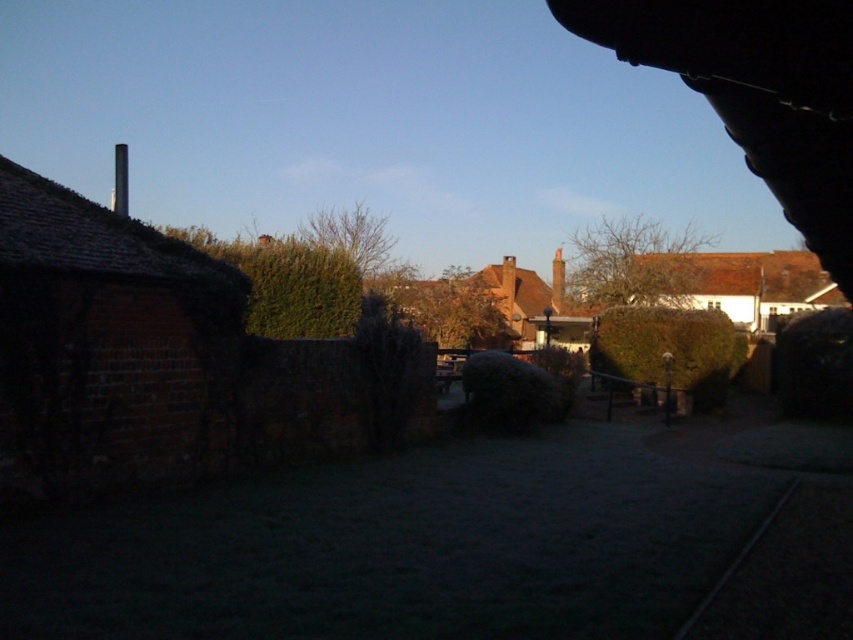
Who is shorter, smooth white chimney at upper left or smooth brick chimney at center?

smooth brick chimney at center

Who is more forward, (115, 182) or (554, 264)?

Point (554, 264) is in front.

Describe the element at coordinates (120, 180) in the screenshot. Image resolution: width=853 pixels, height=640 pixels. I see `smooth white chimney at upper left` at that location.

At what (x,y) coordinates should I click in order to perform the action: click on smooth white chimney at upper left. Please return your answer as a coordinate pair (x, y). Looking at the image, I should click on (120, 180).

Is black metal train track at lower right bigger than smooth brick chimney at center?

Actually, black metal train track at lower right might be smaller than smooth brick chimney at center.

Which is below, black metal train track at lower right or smooth brick chimney at center?

black metal train track at lower right is lower down.

Between point (782, 497) and point (555, 282), which one is positioned in front?

Point (782, 497) is in front.

Find the location of a particular element. The width and height of the screenshot is (853, 640). black metal train track at lower right is located at coordinates (734, 563).

Does black metal train track at lower right appear over smooth white chimney at upper left?

No.

Is point (753, 529) positioned in front of point (126, 154)?

Yes.

What do you see at coordinates (734, 563) in the screenshot?
I see `black metal train track at lower right` at bounding box center [734, 563].

This screenshot has width=853, height=640. Identify the location of black metal train track at lower right. (734, 563).